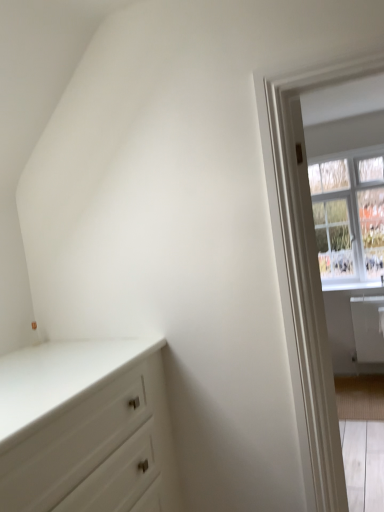
The height and width of the screenshot is (512, 384). Find the location of `empty space that is ontop of white glossy chest of drawers at lower left (from a real-world perspective)`. empty space that is ontop of white glossy chest of drawers at lower left (from a real-world perspective) is located at coordinates (49, 365).